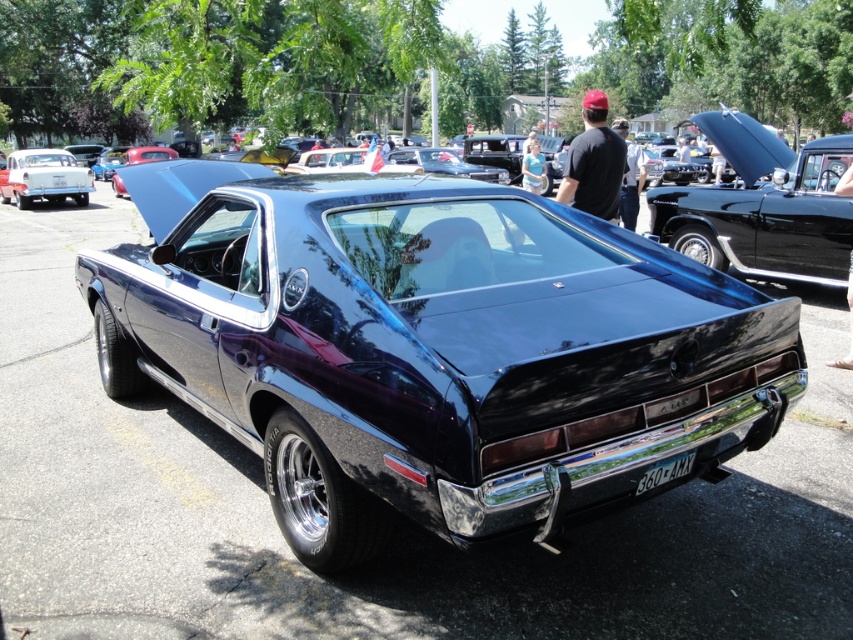
You are a photographer at a car show and want to capture both the glossy black muscle car at center and the white glossy sedan at upper left in a single shot. Which car should you focus on first to ensure both are in frame?

You should focus on the glossy black muscle car at center first because it is closer to the viewer than the white glossy sedan at upper left, so adjusting the camera angle to include both would require starting with the closer vehicle.

You are standing in front of a car show and see the glossy black car at upper right. There is a point marked at coordinates (762, 205). Can you tell me what is located at that point?

The point at coordinates (762, 205) is where the glossy black car at upper right is located.